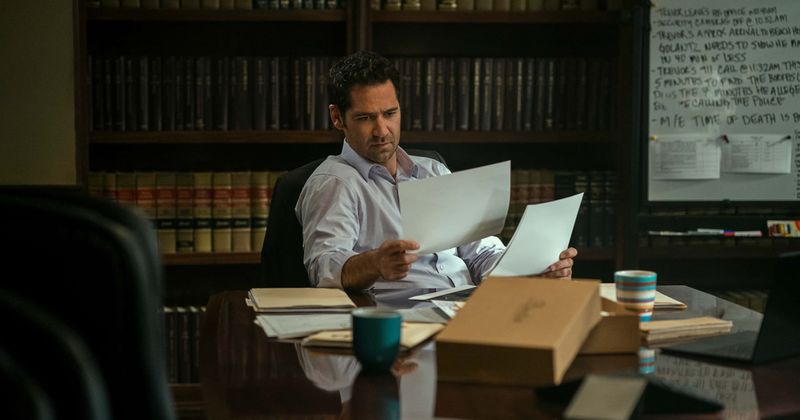
Find the location of a particular element. The width and height of the screenshot is (800, 420). whiteboard is located at coordinates coord(709,191).